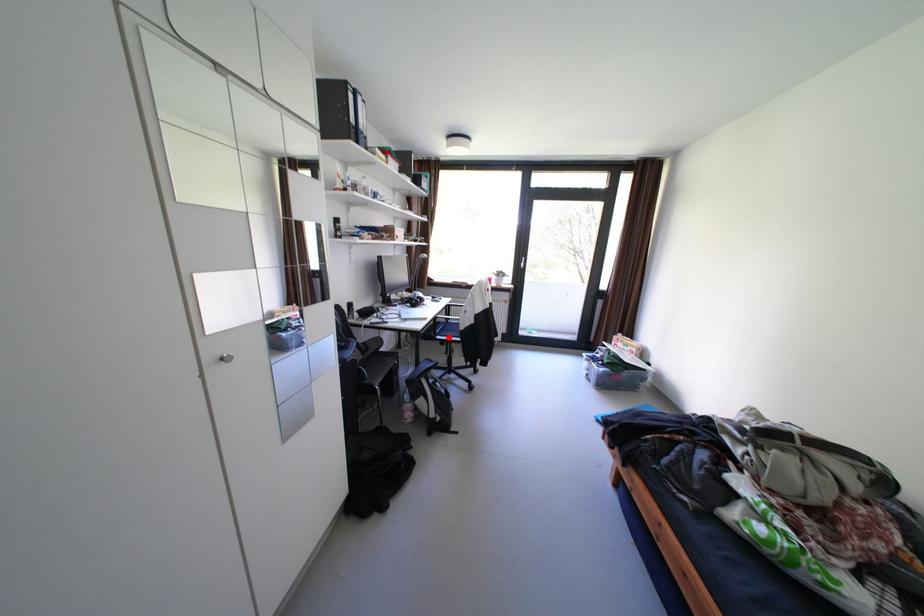
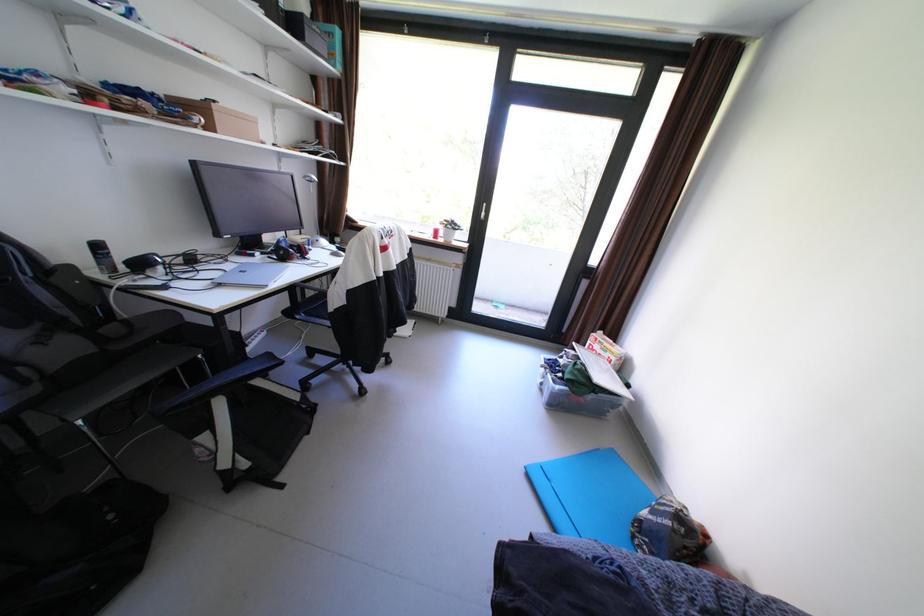
Where in the second image is the point corresponding to the highlighted location from the first image?

(309, 317)